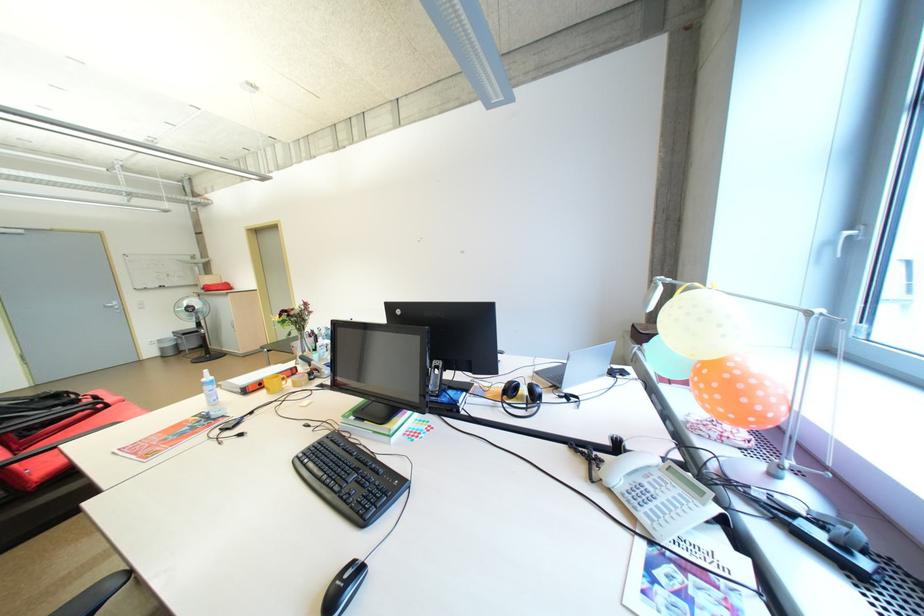
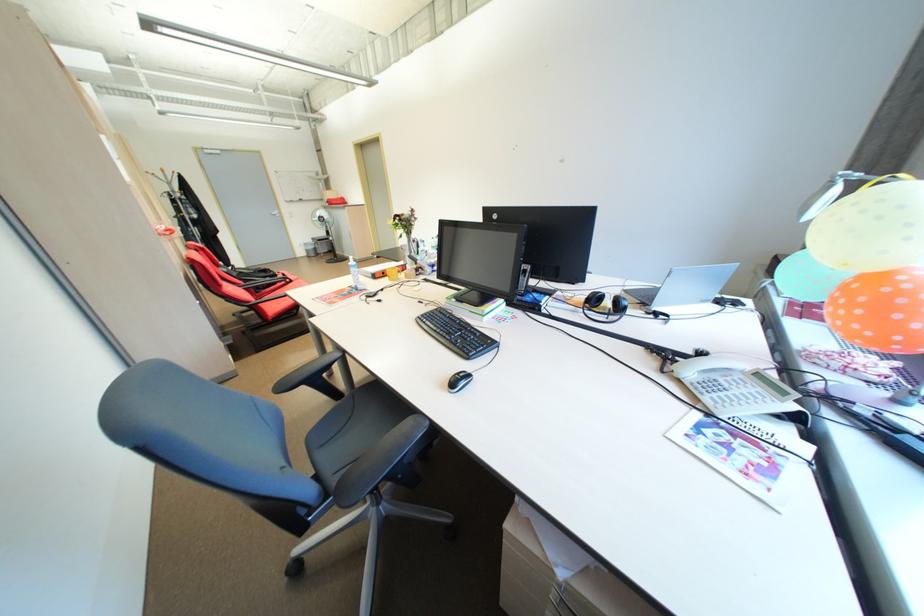
Locate, in the second image, the point that corresponds to point (210, 392) in the first image.

(359, 273)